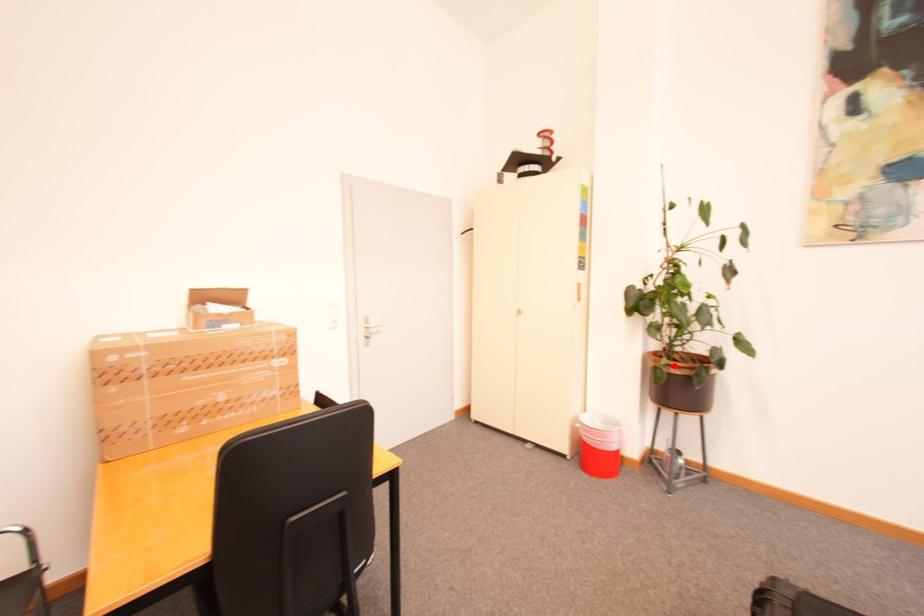
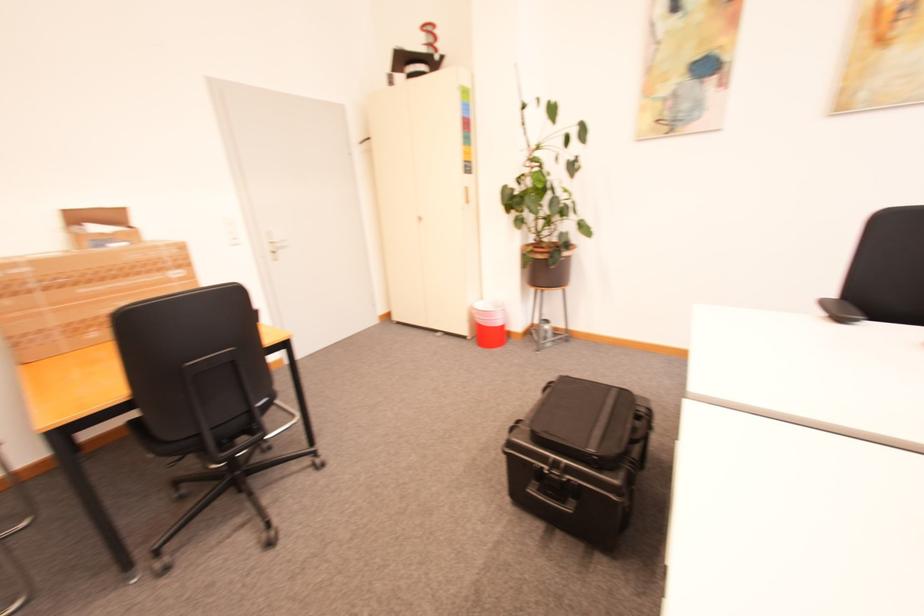
In the second image, find the point that corresponds to the highlighted location in the first image.

(539, 253)